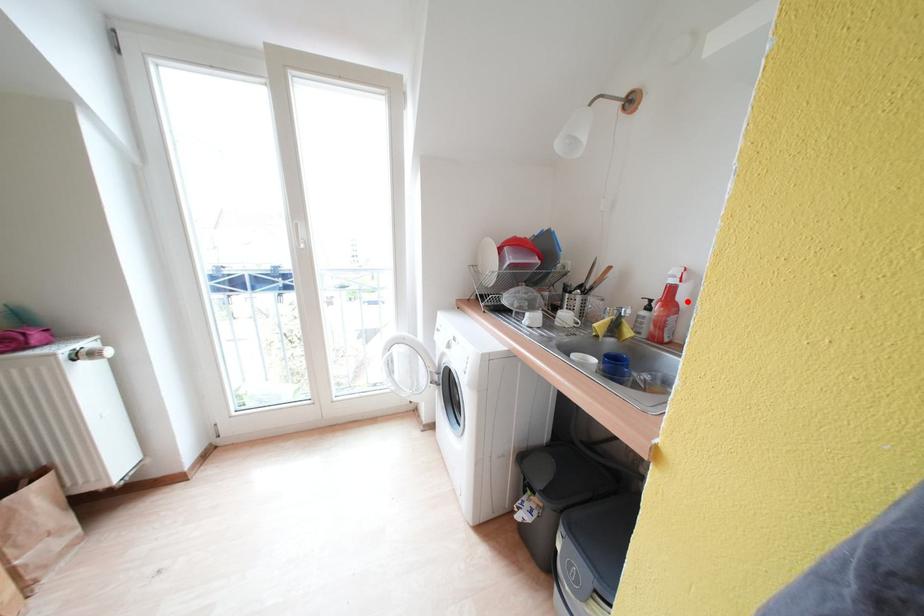
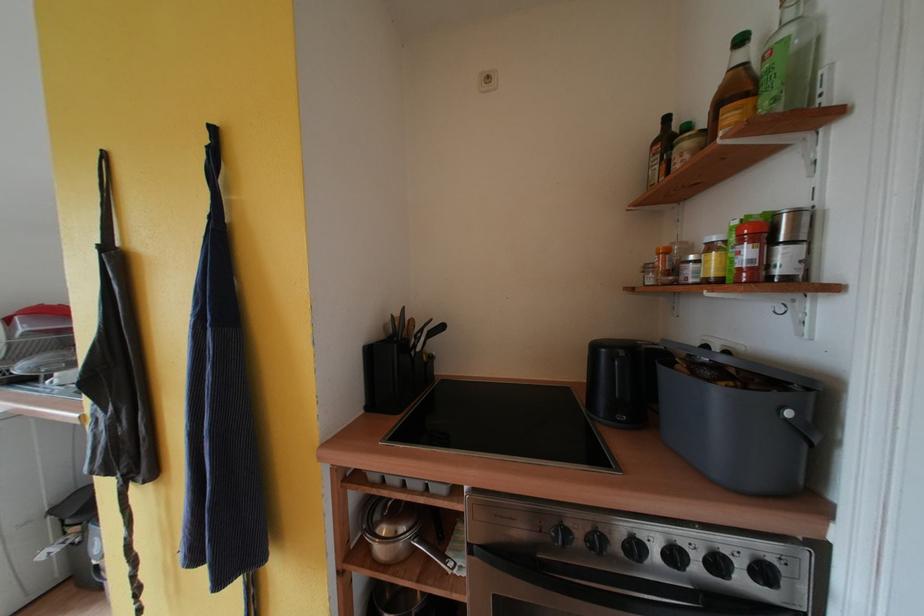
Question: I am providing you with two images of the same scene from different viewpoints. A red point is marked on the first image. At the location where the point appears in image 1, is it still visible in image 2?

Choices:
 (A) Yes
 (B) No

Answer: (B)